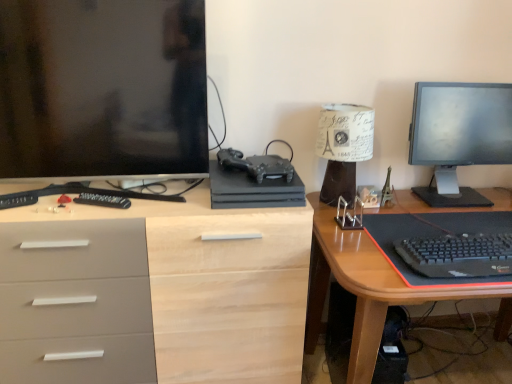
Locate an element on the screen. vacant space to the right of black plastic remote control at left, placed as the second remote control when sorted from left to right is located at coordinates (159, 200).